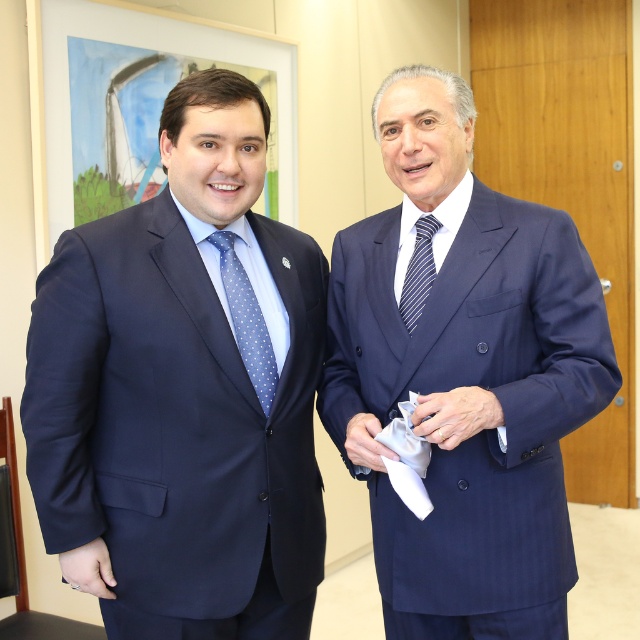
Which is above, satin blue suit at center or blue striped tie at center?

blue striped tie at center is above.

Who is lower down, satin blue suit at center or blue striped tie at center?

satin blue suit at center is lower down.

Between point (448, 589) and point (436, 221), which one is positioned behind?

Positioned behind is point (436, 221).

Find the location of a particular element. satin blue suit at center is located at coordinates (465, 378).

Is point (282, 234) farther from camera compared to point (253, 344)?

Yes, it is.

Can you confirm if matte blue suit at center is positioned below blue dotted tie at left?

Correct, matte blue suit at center is located below blue dotted tie at left.

Which is behind, point (72, 458) or point (243, 298)?

The point (243, 298) is behind.

Where is `matte blue suit at center`? Image resolution: width=640 pixels, height=640 pixels. matte blue suit at center is located at coordinates (182, 394).

Who is more forward, (77, 563) or (413, 314)?

Point (77, 563) is more forward.

Which is above, matte blue suit at center or blue striped tie at center?

blue striped tie at center is higher up.

Who is more forward, (x=74, y=492) or (x=412, y=330)?

Positioned in front is point (x=74, y=492).

You are a GUI agent. You are given a task and a screenshot of the screen. Output one action in this format:
    pyautogui.click(x=<x>, y=<y>)
    Task: Click on the matte blue suit at center
    Image resolution: width=640 pixels, height=640 pixels.
    Given the screenshot: What is the action you would take?
    pyautogui.click(x=182, y=394)